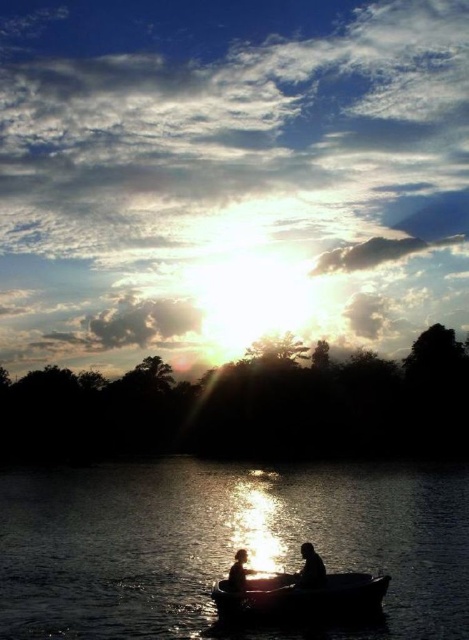
Does silvery reflective water at center lie behind silvery metallic boat at center?

No, it is in front of silvery metallic boat at center.

What do you see at coordinates (224, 541) in the screenshot? I see `silvery reflective water at center` at bounding box center [224, 541].

Where is `silvery reflective water at center`? The image size is (469, 640). silvery reflective water at center is located at coordinates (224, 541).

Does silvery reflective water at center appear on the right side of silhouette human at center?

No, silvery reflective water at center is not to the right of silhouette human at center.

The width and height of the screenshot is (469, 640). What do you see at coordinates (224, 541) in the screenshot?
I see `silvery reflective water at center` at bounding box center [224, 541].

Locate an element on the screen. The height and width of the screenshot is (640, 469). silvery reflective water at center is located at coordinates (224, 541).

Which is in front, point (376, 576) or point (302, 570)?

Point (302, 570) is in front.

Is point (265, 612) in front of point (302, 570)?

Yes, it is in front of point (302, 570).

Does point (361, 609) come behind point (302, 579)?

That is False.

The image size is (469, 640). Identify the location of silvery metallic boat at center. (301, 596).